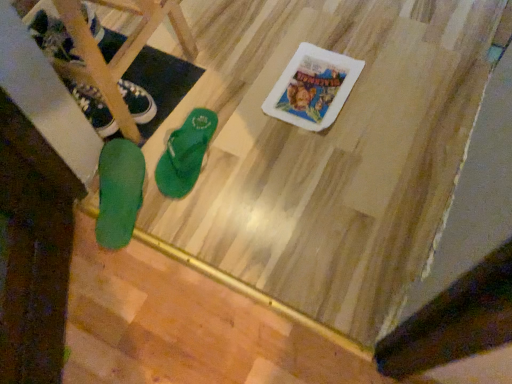
Where is `free location in front of green rubber flip-flop at center, marked as the first footwear in a right-to-left arrangement`? free location in front of green rubber flip-flop at center, marked as the first footwear in a right-to-left arrangement is located at coordinates (203, 210).